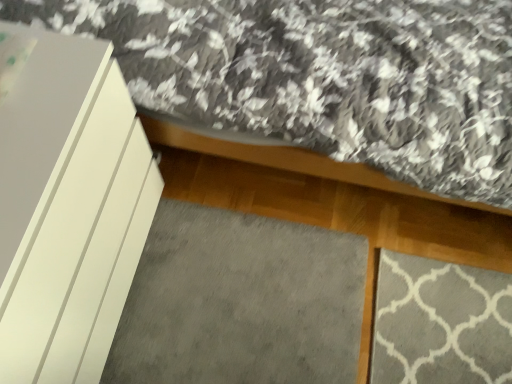
This screenshot has width=512, height=384. I want to click on free space above gray soft carpet at lower center (from a real-world perspective), so click(243, 303).